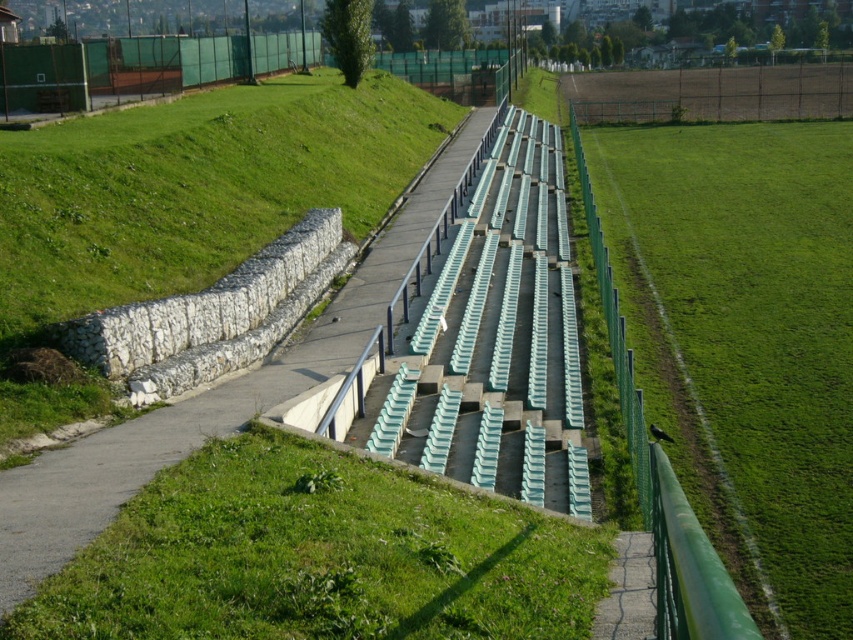
Can you confirm if green grass at right is wider than concrete path at center?

Yes.

How much distance is there between green grass at right and concrete path at center?

green grass at right and concrete path at center are 36.24 feet apart.

You are a GUI agent. You are given a task and a screenshot of the screen. Output one action in this format:
    pyautogui.click(x=<x>, y=<y>)
    Task: Click on the green grass at right
    Image resolution: width=853 pixels, height=640 pixels.
    Given the screenshot: What is the action you would take?
    pyautogui.click(x=746, y=340)

Can you confirm if green grass at right is shorter than green grassy at center?

No, green grass at right is not shorter than green grassy at center.

Is point (779, 436) farther from viewer compared to point (524, 563)?

That is True.

Does point (737, 522) come in front of point (102, 605)?

No, it is not.

Find the location of `green grass at right`. green grass at right is located at coordinates (746, 340).

Can you confirm if green grassy at center is positioned above concrete path at center?

No.

Does green grassy at center have a larger size compared to concrete path at center?

Incorrect, green grassy at center is not larger than concrete path at center.

Identify the location of green grassy at center. (317, 556).